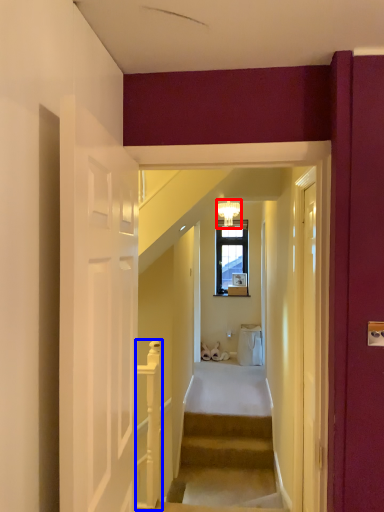
Question: Among these objects, which one is nearest to the camera, light fixture (highlighted by a red box) or rail (highlighted by a blue box)?

Choices:
 (A) light fixture
 (B) rail

Answer: (B)